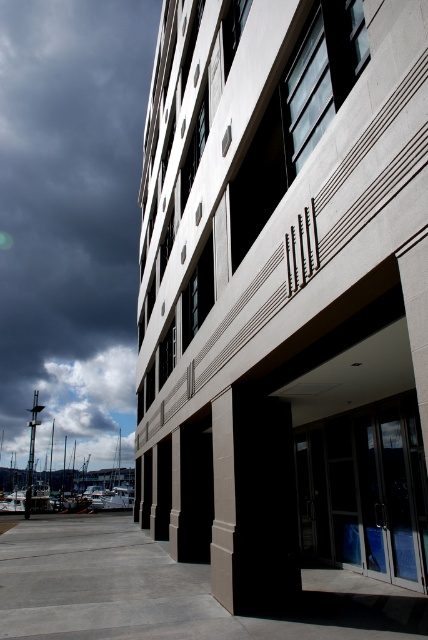
From the picture: Between gray concrete pavement at lower center and transparent glass doors at center, which one has more height?

With more height is gray concrete pavement at lower center.

How distant is gray concrete pavement at lower center from transparent glass doors at center?

A distance of 10.46 feet exists between gray concrete pavement at lower center and transparent glass doors at center.

Who is more distant from viewer, (x=118, y=577) or (x=391, y=508)?

Positioned behind is point (x=118, y=577).

At what (x,y) coordinates should I click in order to perform the action: click on gray concrete pavement at lower center. Please return your answer as a coordinate pair (x, y). The width and height of the screenshot is (428, 640). Looking at the image, I should click on [166, 589].

Which of these two, dark cloudy sky at upper left or white fluffy cloud at upper left, stands taller?

With more height is dark cloudy sky at upper left.

Is dark cloudy sky at upper left behind white fluffy cloud at upper left?

Yes.

Between point (133, 65) and point (79, 448), which one is positioned behind?

Positioned behind is point (133, 65).

Where is `dark cloudy sky at upper left`? This screenshot has height=640, width=428. dark cloudy sky at upper left is located at coordinates (71, 220).

Which of these two, white fluffy cloud at upper left or smooth concrete pillar at center, stands taller?

white fluffy cloud at upper left

Is white fluffy cloud at upper left smaller than smooth concrete pillar at center?

Incorrect, white fluffy cloud at upper left is not smaller in size than smooth concrete pillar at center.

Describe the element at coordinates (74, 404) in the screenshot. I see `white fluffy cloud at upper left` at that location.

The width and height of the screenshot is (428, 640). Find the location of `white fluffy cloud at upper left`. white fluffy cloud at upper left is located at coordinates (x=74, y=404).